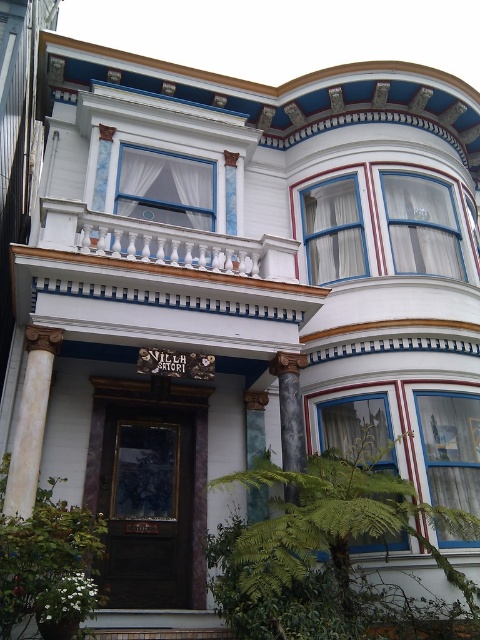
Who is lower down, matte white window at upper right or white fabric curtain at upper center?

matte white window at upper right is below.

Is matte white window at upper right taller than white fabric curtain at upper center?

Correct, matte white window at upper right is much taller as white fabric curtain at upper center.

Who is more forward, [440,209] or [162,195]?

Point [162,195] is in front.

This screenshot has width=480, height=640. Find the location of `matte white window at upper right`. matte white window at upper right is located at coordinates (421, 225).

Between white fabric curtain at upper center and white marble column at left, which one appears on the left side from the viewer's perspective?

Positioned to the left is white marble column at left.

Is point (212, 193) positioned after point (37, 413)?

That is True.

Is point (171, 204) farther from camera compared to point (11, 477)?

Yes, it is behind point (11, 477).

Find the location of a particular element. white fabric curtain at upper center is located at coordinates (165, 188).

Between matte white window at upper right and matte white curtain at upper right, which one has more height?

matte white curtain at upper right is taller.

Does matte white window at upper right lie behind matte white curtain at upper right?

No, it is not.

Who is more distant from viewer, (391, 204) or (344, 256)?

The point (391, 204) is behind.

The width and height of the screenshot is (480, 640). In order to click on matte white window at upper right in this screenshot , I will do `click(421, 225)`.